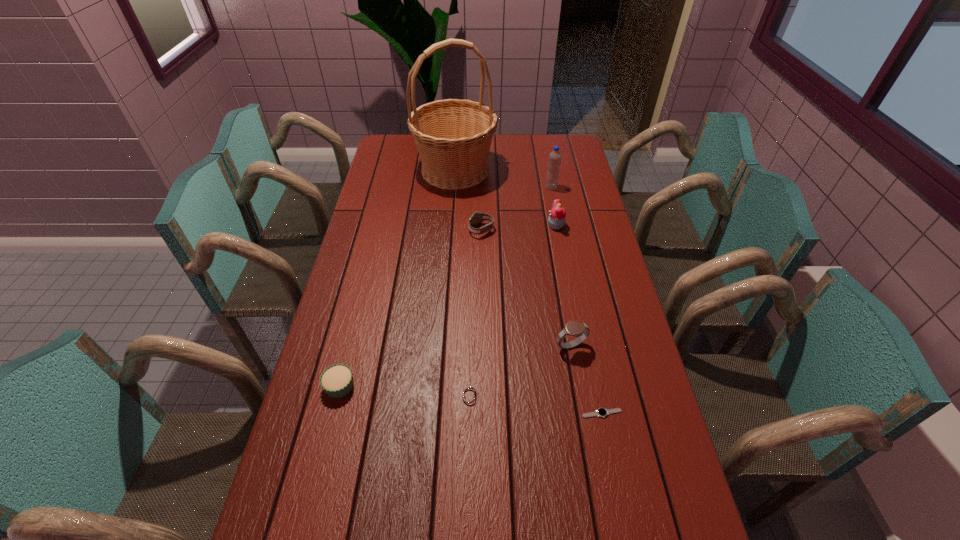
At what (x,y) coordinates should I click in order to perform the action: click on vacant space at the far edge of the desktop. Please return your answer as a coordinate pair (x, y). Image resolution: width=960 pixels, height=540 pixels. Looking at the image, I should click on (537, 150).

At what (x,y) coordinates should I click in order to perform the action: click on free spot at the left edge of the desktop. Please return your answer as a coordinate pair (x, y). The width and height of the screenshot is (960, 540). Looking at the image, I should click on (319, 459).

You are a GUI agent. You are given a task and a screenshot of the screen. Output one action in this format:
    pyautogui.click(x=<x>, y=<y>)
    Task: Click on the vacant region at the right edge of the desktop
    The image size is (960, 540).
    Given the screenshot: What is the action you would take?
    pyautogui.click(x=573, y=211)

Identify the location of vacant region at the far left corner of the desktop. The width and height of the screenshot is (960, 540). (403, 160).

In the image, there is a desktop. What are the coordinates of `free space at the far right corner` in the screenshot? It's located at (547, 143).

Where is `unoccupied area between the second farthest watch and the water bottle`? unoccupied area between the second farthest watch and the water bottle is located at coordinates [561, 267].

Locate an element on the screen. This screenshot has height=540, width=960. vacant point located between the shortest watch and the taller cupcake is located at coordinates (579, 320).

Identify the location of free space between the tallest object and the shorter cupcake. (397, 278).

Where is `vacant area that lies between the water bottle and the shortest object`? The height and width of the screenshot is (540, 960). vacant area that lies between the water bottle and the shortest object is located at coordinates (577, 300).

Find the location of `vacant space that is in between the second shortest object and the shortest watch`. vacant space that is in between the second shortest object and the shortest watch is located at coordinates (536, 404).